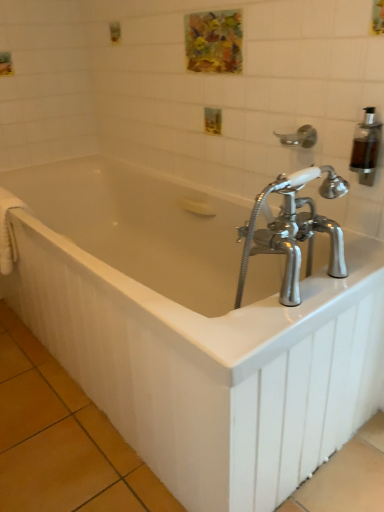
Question: Does transparent plastic soap dispenser at upper right have a lesser height compared to white fabric towel bar at left?

Choices:
 (A) no
 (B) yes

Answer: (B)

Question: Considering the relative sizes of transparent plastic soap dispenser at upper right and white fabric towel bar at left in the image provided, is transparent plastic soap dispenser at upper right bigger than white fabric towel bar at left?

Choices:
 (A) yes
 (B) no

Answer: (B)

Question: Would you say white fabric towel bar at left is part of transparent plastic soap dispenser at upper right's contents?

Choices:
 (A) yes
 (B) no

Answer: (B)

Question: Does transparent plastic soap dispenser at upper right turn towards white fabric towel bar at left?

Choices:
 (A) no
 (B) yes

Answer: (A)

Question: Is transparent plastic soap dispenser at upper right far away from white fabric towel bar at left?

Choices:
 (A) no
 (B) yes

Answer: (B)

Question: From the image's perspective, does transparent plastic soap dispenser at upper right appear higher than white fabric towel bar at left?

Choices:
 (A) yes
 (B) no

Answer: (A)

Question: Is white glossy bathtub at center surrounded by silver metallic shower head at upper right?

Choices:
 (A) yes
 (B) no

Answer: (B)

Question: Can we say silver metallic shower head at upper right lies outside white glossy bathtub at center?

Choices:
 (A) no
 (B) yes

Answer: (B)

Question: Is silver metallic shower head at upper right oriented away from white glossy bathtub at center?

Choices:
 (A) yes
 (B) no

Answer: (B)

Question: Considering the relative sizes of silver metallic shower head at upper right and white glossy bathtub at center in the image provided, is silver metallic shower head at upper right taller than white glossy bathtub at center?

Choices:
 (A) yes
 (B) no

Answer: (B)

Question: Does silver metallic shower head at upper right have a smaller size compared to white glossy bathtub at center?

Choices:
 (A) no
 (B) yes

Answer: (B)

Question: Is silver metallic shower head at upper right positioned far away from white glossy bathtub at center?

Choices:
 (A) no
 (B) yes

Answer: (A)

Question: Is silver metallic shower head at upper right positioned beyond the bounds of watercolor painting at upper center?

Choices:
 (A) yes
 (B) no

Answer: (A)